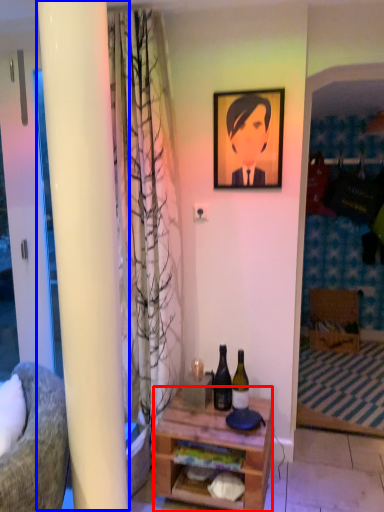
Question: Among these objects, which one is nearest to the camera, desk (highlighted by a red box) or pillar (highlighted by a blue box)?

Choices:
 (A) desk
 (B) pillar

Answer: (A)